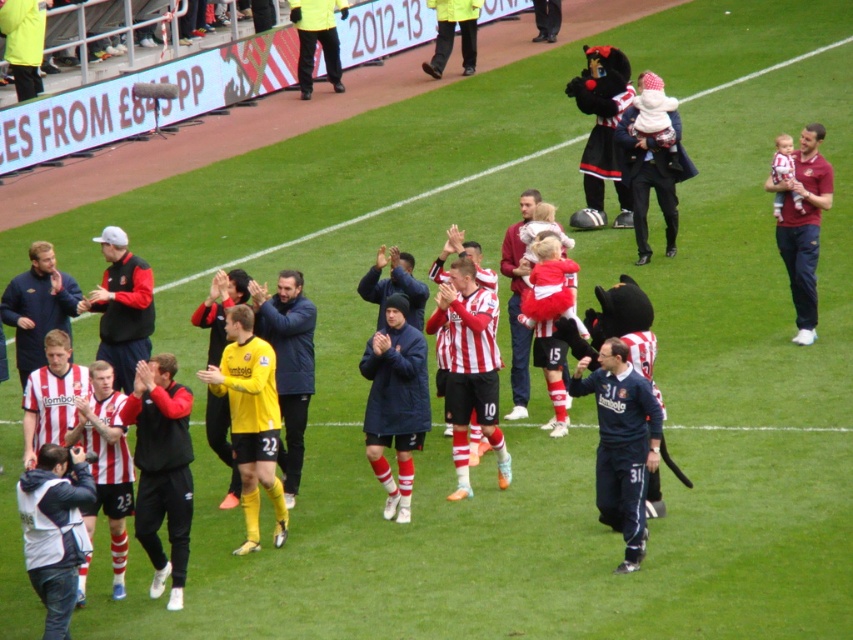
Can you confirm if dark blue jersey at center is positioned to the right of matte black jacket at center?

Indeed, dark blue jersey at center is positioned on the right side of matte black jacket at center.

At what (x,y) coordinates should I click in order to perform the action: click on dark blue jersey at center. Please return your answer as a coordinate pair (x, y). This screenshot has width=853, height=640. Looking at the image, I should click on (621, 444).

Which of these two, dark blue jersey at center or yellow uniform at upper left, stands shorter?

Standing shorter between the two is dark blue jersey at center.

Who is more forward, (x=614, y=420) or (x=321, y=16)?

Point (x=614, y=420) is more forward.

The width and height of the screenshot is (853, 640). Find the location of `dark blue jersey at center`. dark blue jersey at center is located at coordinates (621, 444).

From the picture: Is black track pants at center thinner than maroon jersey at right?

Yes, black track pants at center is thinner than maroon jersey at right.

Can you confirm if black track pants at center is positioned above maroon jersey at right?

Incorrect, black track pants at center is not positioned above maroon jersey at right.

Does point (138, 499) come in front of point (781, 195)?

Yes.

Identify the location of black track pants at center. (161, 468).